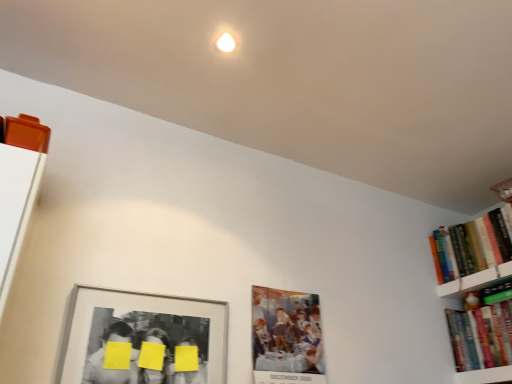
Question: Would you consider hardcover books at right, which is counted as the 1th book, starting from the top, to be distant from matte paper picture frame at center, which is counted as the second picture frame, starting from the left?

Choices:
 (A) no
 (B) yes

Answer: (A)

Question: Can you confirm if hardcover books at right, positioned as the second book in bottom-to-top order, is positioned to the left of matte paper picture frame at center, which is counted as the first picture frame, starting from the right?

Choices:
 (A) no
 (B) yes

Answer: (A)

Question: Are hardcover books at right, which is counted as the 1th book, starting from the top, and matte paper picture frame at center, which is counted as the second picture frame, starting from the left, making contact?

Choices:
 (A) no
 (B) yes

Answer: (A)

Question: Could you tell me if hardcover books at right, positioned as the second book in bottom-to-top order, is facing matte paper picture frame at center, which is counted as the second picture frame, starting from the left?

Choices:
 (A) no
 (B) yes

Answer: (A)

Question: Does hardcover books at right, positioned as the second book in bottom-to-top order, have a greater width compared to matte paper picture frame at center, which is counted as the first picture frame, starting from the right?

Choices:
 (A) no
 (B) yes

Answer: (B)

Question: From a real-world perspective, relative to hardcover books at right, positioned as the second book in bottom-to-top order, is yellow matte paper at center vertically above or below?

Choices:
 (A) below
 (B) above

Answer: (A)

Question: Considering the positions of yellow matte paper at center and hardcover books at right, which is counted as the 1th book, starting from the top, in the image, is yellow matte paper at center bigger or smaller than hardcover books at right, which is counted as the 1th book, starting from the top,?

Choices:
 (A) big
 (B) small

Answer: (B)

Question: Choose the correct answer: Is yellow matte paper at center inside hardcover books at right, which is counted as the 1th book, starting from the top, or outside it?

Choices:
 (A) outside
 (B) inside

Answer: (A)

Question: Considering the positions of yellow matte paper at center and hardcover books at right, which is counted as the 1th book, starting from the top, in the image, is yellow matte paper at center taller or shorter than hardcover books at right, which is counted as the 1th book, starting from the top,?

Choices:
 (A) tall
 (B) short

Answer: (B)

Question: Which is correct: matte paper picture frame at center, which is counted as the first picture frame, starting from the right, is inside matte silver picture frame at lower left, placed as the second picture frame when sorted from right to left, or outside of it?

Choices:
 (A) outside
 (B) inside

Answer: (A)

Question: Is matte paper picture frame at center, which is counted as the second picture frame, starting from the left, wider or thinner than matte silver picture frame at lower left, placed as the second picture frame when sorted from right to left?

Choices:
 (A) thin
 (B) wide

Answer: (B)

Question: From a real-world perspective, is matte paper picture frame at center, which is counted as the first picture frame, starting from the right, above or below matte silver picture frame at lower left, placed as the second picture frame when sorted from right to left?

Choices:
 (A) above
 (B) below

Answer: (A)

Question: From their relative heights in the image, would you say matte paper picture frame at center, which is counted as the first picture frame, starting from the right, is taller or shorter than matte silver picture frame at lower left, the first picture frame positioned from the left?

Choices:
 (A) tall
 (B) short

Answer: (A)

Question: Considering the positions of matte silver picture frame at lower left, placed as the second picture frame when sorted from right to left, and hardcover books at right, which is counted as the 1th book, starting from the top, in the image, is matte silver picture frame at lower left, placed as the second picture frame when sorted from right to left, bigger or smaller than hardcover books at right, which is counted as the 1th book, starting from the top,?

Choices:
 (A) big
 (B) small

Answer: (B)

Question: In terms of width, does matte silver picture frame at lower left, placed as the second picture frame when sorted from right to left, look wider or thinner when compared to hardcover books at right, which is counted as the 1th book, starting from the top?

Choices:
 (A) wide
 (B) thin

Answer: (B)